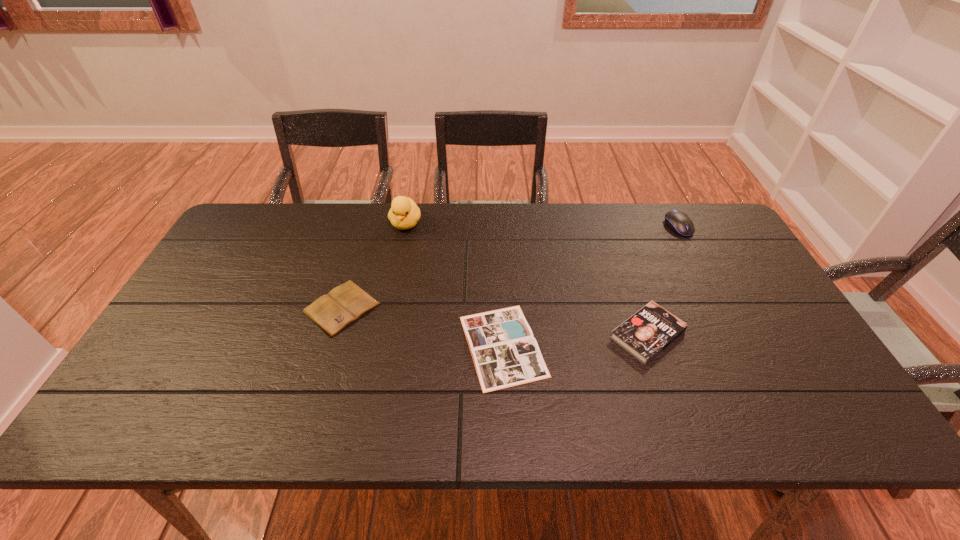
Identify the location of vacant region at the far left corner. (238, 243).

Locate an element on the screen. Image resolution: width=960 pixels, height=540 pixels. vacant space at the near left corner of the desktop is located at coordinates (141, 410).

The width and height of the screenshot is (960, 540). Identify the location of free space at the far right corner of the desktop. (673, 205).

Locate an element on the screen. The height and width of the screenshot is (540, 960). free spot between the leftmost book and the third object from left to right is located at coordinates (422, 327).

This screenshot has height=540, width=960. I want to click on free space between the second object from right to left and the fourth shortest object, so click(x=663, y=280).

This screenshot has width=960, height=540. Find the location of `unoccupied area between the third object from right to left and the third tallest object`. unoccupied area between the third object from right to left and the third tallest object is located at coordinates (575, 340).

Find the location of a particular element. unoccupied position between the second book from left to right and the leftmost book is located at coordinates (422, 327).

Locate an element on the screen. empty space that is in between the second object from right to left and the duck is located at coordinates (527, 279).

The height and width of the screenshot is (540, 960). Find the location of `vacant point located between the duck and the rightmost object`. vacant point located between the duck and the rightmost object is located at coordinates (542, 225).

This screenshot has width=960, height=540. Find the location of `free point between the duck and the second object from right to left`. free point between the duck and the second object from right to left is located at coordinates (527, 279).